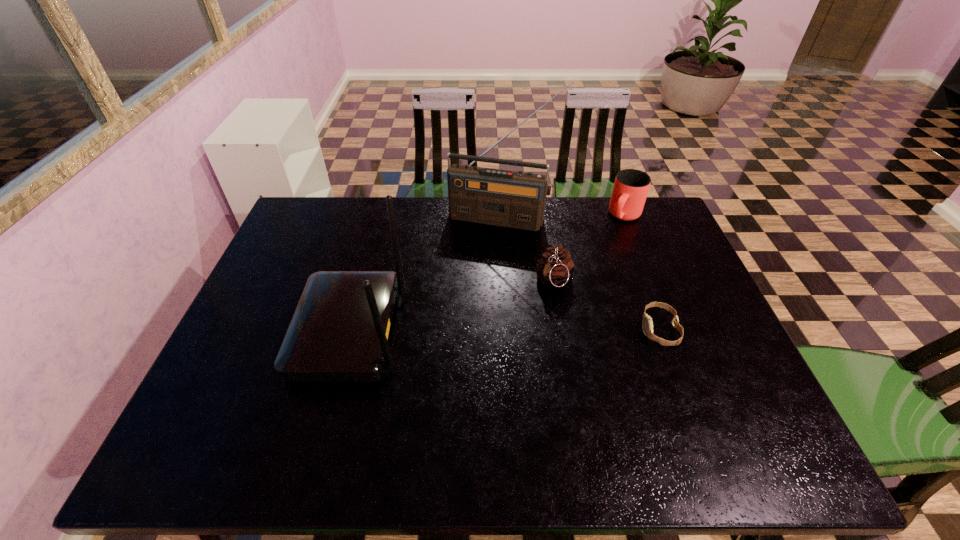
Image resolution: width=960 pixels, height=540 pixels. What are the coordinates of `blank space at the near edge of the desktop` in the screenshot? It's located at (588, 415).

This screenshot has height=540, width=960. In the image, there is a desktop. What are the coordinates of `vacant area at the left edge` in the screenshot? It's located at (278, 286).

The image size is (960, 540). In the image, there is a desktop. Identify the location of vacant area at the far left corner. (307, 218).

Identify the location of vacant region at the far right corner of the desktop. The width and height of the screenshot is (960, 540). (660, 231).

The height and width of the screenshot is (540, 960). In order to click on vacant area between the radio receiver and the router in this screenshot , I will do `click(426, 275)`.

The width and height of the screenshot is (960, 540). Find the location of `free space between the second shortest object and the second tallest object`. free space between the second shortest object and the second tallest object is located at coordinates (452, 306).

Identify the location of vacant point located between the pinecone and the cup. This screenshot has width=960, height=540. (589, 248).

The image size is (960, 540). I want to click on free space between the pinecone and the router, so (x=452, y=306).

The height and width of the screenshot is (540, 960). Find the location of `vacant space that is in between the cup and the fourth tallest object`. vacant space that is in between the cup and the fourth tallest object is located at coordinates (589, 248).

The image size is (960, 540). What are the coordinates of `vacant region between the router and the tallest object` in the screenshot? It's located at (426, 275).